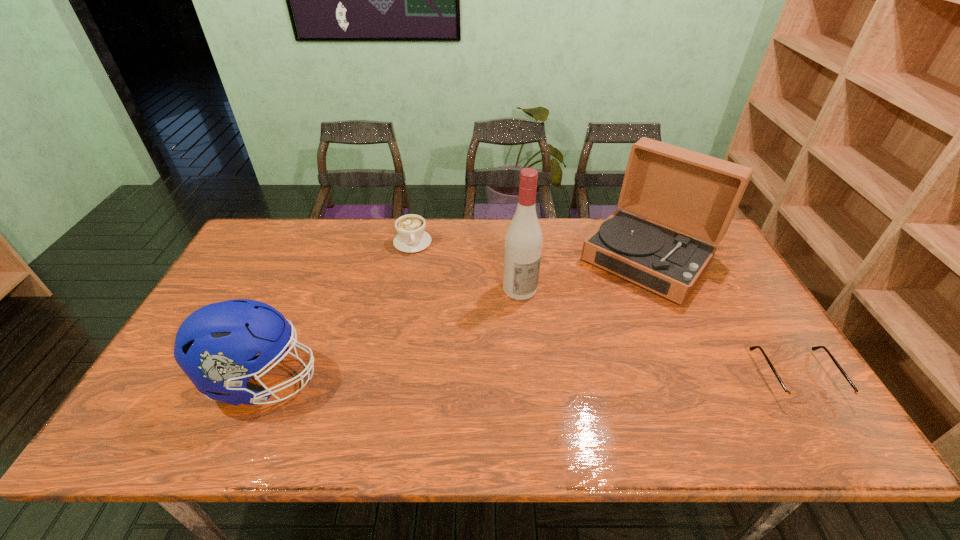
Locate an element on the screen. The image size is (960, 540). free location located 0.110m on the label of the third object from left to right is located at coordinates (547, 326).

Find the location of `vacant region located on the label of the third object from left to right`. vacant region located on the label of the third object from left to right is located at coordinates (545, 323).

You are a GUI agent. You are given a task and a screenshot of the screen. Output one action in this format:
    pyautogui.click(x=<x>, y=<y>)
    Task: Click on the vacant space located 0.330m to the right of the fourth object from right to left's handle
    
    Given the screenshot: What is the action you would take?
    pyautogui.click(x=438, y=328)

Locate an element on the screen. Image resolution: width=960 pixels, height=540 pixels. free space located 0.300m to the right of the fourth object from right to left's handle is located at coordinates (435, 320).

Locate an element on the screen. This screenshot has width=960, height=540. free space located 0.360m to the right of the fourth object from right to left's handle is located at coordinates (440, 336).

Where is `vacant region located on the face of the second tallest object`? The image size is (960, 540). vacant region located on the face of the second tallest object is located at coordinates (601, 314).

Find the location of a particular element. blank area located 0.240m on the face of the second tallest object is located at coordinates [575, 345].

Identify the location of free space located 0.300m on the face of the second tallest object. The height and width of the screenshot is (540, 960). (563, 359).

At what (x,y) coordinates should I click in order to perform the action: click on cappuccino that is at the far edge. Please return your answer as a coordinate pair (x, y). This screenshot has width=960, height=540. Looking at the image, I should click on (411, 237).

In order to click on phonograph record that is at the far edge in this screenshot , I will do `click(693, 193)`.